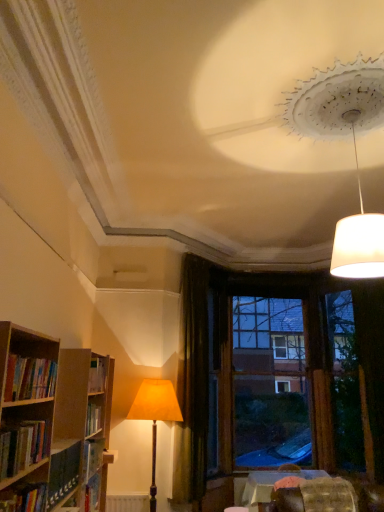
The width and height of the screenshot is (384, 512). What do you see at coordinates (354, 150) in the screenshot?
I see `white matte lampshade at upper right, the 1th lamp positioned from the right` at bounding box center [354, 150].

Measure the distance between point (188, 260) and camera.

The distance of point (188, 260) from camera is 5.82 meters.

Describe the element at coordinates (155, 416) in the screenshot. I see `matte orange fabric lampshade at center, acting as the 2th lamp starting from the top` at that location.

The width and height of the screenshot is (384, 512). Identify the location of brown wooden window frame at center. (270, 383).

This screenshot has height=512, width=384. Describe the element at coordinates (270, 383) in the screenshot. I see `brown wooden window frame at center` at that location.

Image resolution: width=384 pixels, height=512 pixels. Identify the location of hardcover book at lower left, which ranks as the 1th book in bottom-to-top order. click(x=25, y=499).

What is the approximate width of hardcover book at lower left, which ranks as the 1th book in bottom-to-top order?

hardcover book at lower left, which ranks as the 1th book in bottom-to-top order, is 8.71 inches in width.

The height and width of the screenshot is (512, 384). What are the coordinates of `white matte lampshade at upper right, arranged as the 2th lamp when viewed from the back` in the screenshot? It's located at (354, 150).

Is hardcover books at left, arranged as the 3th book when ordered from the bottom, not near hardcover book at lower left, positioned as the third book in top-to-bottom order?

No, hardcover books at left, arranged as the 3th book when ordered from the bottom, is not far from hardcover book at lower left, positioned as the third book in top-to-bottom order.

Considering the positions of point (32, 384) and point (6, 507), is point (32, 384) closer or farther from the camera than point (6, 507)?

Point (32, 384).

Locate an element on the screen. Image resolution: width=384 pixels, height=512 pixels. book behind the hardcover book at lower left, which ranks as the 1th book in bottom-to-top order is located at coordinates [x=29, y=378].

From a real-world perspective, is hardcover books at left, the first book from the top, over hardcover book at lower left, which ranks as the 1th book in bottom-to-top order?

Yes.

Is wooden textured table at lower center bigger or smaller than hardcover book at lower left, positioned as the third book in top-to-bottom order?

Clearly, wooden textured table at lower center is larger in size than hardcover book at lower left, positioned as the third book in top-to-bottom order.

Is wooden textured table at lower center aimed at hardcover book at lower left, which ranks as the 1th book in bottom-to-top order?

No.

Does wooden textured table at lower center have a greater height compared to hardcover book at lower left, which ranks as the 1th book in bottom-to-top order?

Correct, wooden textured table at lower center is much taller as hardcover book at lower left, which ranks as the 1th book in bottom-to-top order.

What's the angular difference between hardcover book at lower left, positioned as the third book in top-to-bottom order, and white matte lampshade at upper right, arranged as the 2th lamp when viewed from the back,'s facing directions?

They differ by 92.5 degrees in their facing directions.

Choose the correct answer: Is hardcover book at lower left, positioned as the third book in top-to-bottom order, inside white matte lampshade at upper right, the second lamp viewed from the left, or outside it?

hardcover book at lower left, positioned as the third book in top-to-bottom order, is spatially situated outside white matte lampshade at upper right, the second lamp viewed from the left.

From the image's perspective, is hardcover book at lower left, which ranks as the 1th book in bottom-to-top order, above white matte lampshade at upper right, arranged as the 2th lamp when viewed from the back?

Incorrect, from the image's perspective, hardcover book at lower left, which ranks as the 1th book in bottom-to-top order, is lower than white matte lampshade at upper right, arranged as the 2th lamp when viewed from the back.

This screenshot has width=384, height=512. I want to click on lamp above the hardcover book at lower left, which ranks as the 1th book in bottom-to-top order (from a real-world perspective), so click(x=354, y=150).

Looking at this image, considering the positions of objects textured fabric swivel chair at lower right and dark velvet curtain at center in the image provided, who is more to the left, textured fabric swivel chair at lower right or dark velvet curtain at center?

dark velvet curtain at center.

Can you confirm if textured fabric swivel chair at lower right is smaller than dark velvet curtain at center?

Correct, textured fabric swivel chair at lower right occupies less space than dark velvet curtain at center.

How different are the orientations of textured fabric swivel chair at lower right and dark velvet curtain at center in degrees?

textured fabric swivel chair at lower right and dark velvet curtain at center are facing 49.1 degrees away from each other.

Locate an element on the screen. Image resolution: width=384 pixels, height=512 pixels. curtain that is behind the hardcover book at lower left, positioned as the third book in top-to-bottom order is located at coordinates (192, 385).

Is hardcover book at lower left, which ranks as the 1th book in bottom-to-top order, positioned beyond the bounds of dark velvet curtain at center?

Yes, hardcover book at lower left, which ranks as the 1th book in bottom-to-top order, is not within dark velvet curtain at center.

Which object is thinner, hardcover book at lower left, which ranks as the 1th book in bottom-to-top order, or dark velvet curtain at center?

dark velvet curtain at center is thinner.

In the scene shown: Is hardcover book at lower left, which ranks as the 1th book in bottom-to-top order, beside dark velvet curtain at center?

No.

In terms of height, does white matte lampshade at upper right, arranged as the 2th lamp when viewed from the back, look taller or shorter compared to hardcover book at lower left, positioned as the third book in top-to-bottom order?

In the image, white matte lampshade at upper right, arranged as the 2th lamp when viewed from the back, appears to be taller than hardcover book at lower left, positioned as the third book in top-to-bottom order.

Measure the distance from white matte lampshade at upper right, which appears as the 1th lamp when viewed from the top, to hardcover book at lower left, positioned as the third book in top-to-bottom order.

The distance of white matte lampshade at upper right, which appears as the 1th lamp when viewed from the top, from hardcover book at lower left, positioned as the third book in top-to-bottom order, is 2.83 meters.

Which of these two, white matte lampshade at upper right, the 1th lamp positioned from the right, or hardcover book at lower left, positioned as the third book in top-to-bottom order, is thinner?

hardcover book at lower left, positioned as the third book in top-to-bottom order.

Is white matte lampshade at upper right, arranged as the 2th lamp when viewed from the back, at the left side of hardcover book at lower left, positioned as the third book in top-to-bottom order?

No.

From a real-world perspective, which object stands above the other?

hardcover books at left, the first book from the top.

Is hardcover books at left, the first book from the top, inside the boundaries of textured fabric swivel chair at lower right, or outside?

hardcover books at left, the first book from the top, is outside textured fabric swivel chair at lower right.

Based on the photo, which object is positioned more to the left, hardcover books at left, the first book from the top, or textured fabric swivel chair at lower right?

Positioned to the left is hardcover books at left, the first book from the top.

Considering the positions of point (52, 368) and point (350, 488), is point (52, 368) closer or farther from the camera than point (350, 488)?

Clearly, point (52, 368) is closer to the camera than point (350, 488).

Identify the location of the 2nd book below the hardcover books at left, arranged as the 3th book when ordered from the bottom (from the image's perspective). (25, 499).

Locate an element on the screen. This screenshot has height=512, width=384. table behind the hardcover book at lower left, positioned as the third book in top-to-bottom order is located at coordinates (270, 484).

Looking at the image, which one is located further to hardcover books at left, arranged as the 3th book when ordered from the bottom, dark velvet curtain at center or brown wooden window frame at center?

brown wooden window frame at center lies further to hardcover books at left, arranged as the 3th book when ordered from the bottom, than the other object.

From the image, which object appears to be nearer to dark velvet curtain at center, hardcover book at lower left, positioned as the third book in top-to-bottom order, or white matte lampshade at upper right, which appears as the 1th lamp when viewed from the top?

Based on the image, hardcover book at lower left, positioned as the third book in top-to-bottom order, appears to be nearer to dark velvet curtain at center.

Considering their positions, is hardcover books at left, arranged as the 3th book when ordered from the bottom, positioned closer to dark velvet curtain at center than wooden textured table at lower center?

Among the two, wooden textured table at lower center is located nearer to dark velvet curtain at center.

Considering their positions, is wooden textured table at lower center positioned closer to matte orange fabric lampshade at center, which is counted as the second lamp, starting from the front, than hardcover book at lower left, positioned as the third book in top-to-bottom order?

wooden textured table at lower center lies closer to matte orange fabric lampshade at center, which is counted as the second lamp, starting from the front, than the other object.

Considering their positions, is brown wooden window frame at center positioned closer to textured fabric swivel chair at lower right than hardcover book at lower left, which ranks as the 1th book in bottom-to-top order?

The object closer to textured fabric swivel chair at lower right is brown wooden window frame at center.

Which object lies nearer to the anchor point hardcover book at lower left, positioned as the third book in top-to-bottom order, hardcover books at left, the second book in the bottom-to-top sequence, or textured fabric swivel chair at lower right?

hardcover books at left, the second book in the bottom-to-top sequence, is positioned closer to the anchor hardcover book at lower left, positioned as the third book in top-to-bottom order.

Looking at the image, which one is located further to hardcover books at left, the second book in the bottom-to-top sequence, hardcover book at lower left, which ranks as the 1th book in bottom-to-top order, or brown wooden window frame at center?

brown wooden window frame at center is further to hardcover books at left, the second book in the bottom-to-top sequence.

Looking at the image, which one is located closer to hardcover books at left, the second book in the bottom-to-top sequence, white matte lampshade at upper right, the 1th lamp positioned from the right, or wooden textured table at lower center?

white matte lampshade at upper right, the 1th lamp positioned from the right.

Where is `book between hardcover book at lower left, which ranks as the 1th book in bottom-to-top order, and wooden textured table at lower center in the front-back direction`? The image size is (384, 512). book between hardcover book at lower left, which ranks as the 1th book in bottom-to-top order, and wooden textured table at lower center in the front-back direction is located at coordinates (29, 378).

The image size is (384, 512). I want to click on book between hardcover books at left, the first book from the top, and hardcover book at lower left, positioned as the third book in top-to-bottom order, in the up-down direction, so click(23, 446).

At what (x,y) coordinates should I click in order to perform the action: click on book between hardcover book at lower left, positioned as the third book in top-to-bottom order, and matte orange fabric lampshade at center, placed as the 2th lamp when sorted from right to left, from front to back. Please return your answer as a coordinate pair (x, y). Looking at the image, I should click on (29, 378).

You are a GUI agent. You are given a task and a screenshot of the screen. Output one action in this format:
    pyautogui.click(x=<x>, y=<y>)
    Task: Click on the curtain located between matte orange fabric lampshade at center, which is counted as the second lamp, starting from the front, and brown wooden window frame at center in the depth direction
    Image resolution: width=384 pixels, height=512 pixels.
    Given the screenshot: What is the action you would take?
    pyautogui.click(x=192, y=385)